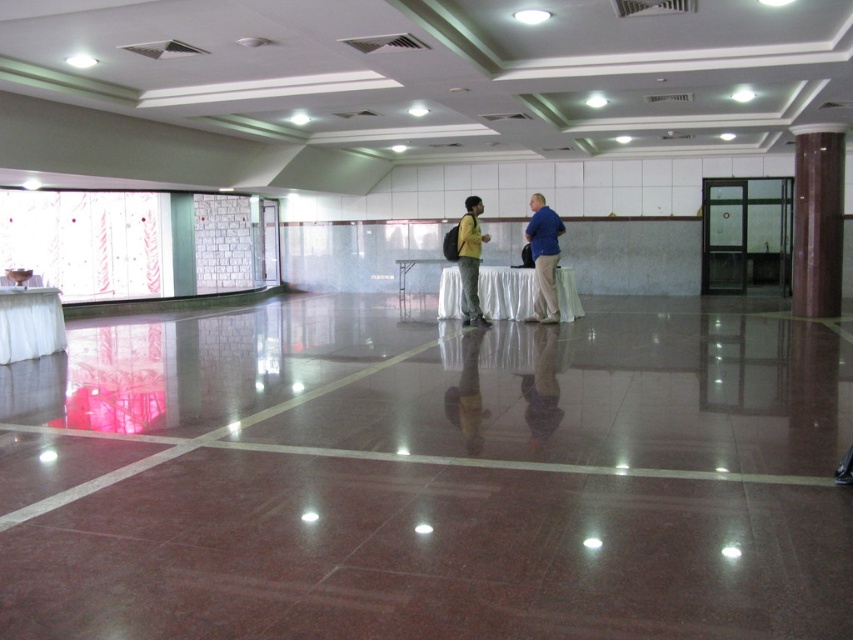
Between yellow-green fabric backpack at center and white cloth-covered table at center, which one is positioned higher?

yellow-green fabric backpack at center is higher up.

Which is behind, point (480, 202) or point (442, 282)?

The point (480, 202) is more distant.

This screenshot has height=640, width=853. I want to click on yellow-green fabric backpack at center, so click(543, 257).

Between point (54, 301) and point (558, 312), which one is positioned in front?

Point (54, 301)

Which is below, white cloth table at left or blue fabric shirt at center?

white cloth table at left

Identify the location of white cloth table at left. This screenshot has height=640, width=853. (28, 323).

The width and height of the screenshot is (853, 640). In order to click on white cloth table at left in this screenshot , I will do `click(28, 323)`.

Is brown polished column at right shorter than white cloth-covered table at center?

No.

Is the position of brown polished column at right less distant than that of white cloth-covered table at center?

No, it is behind white cloth-covered table at center.

Between point (830, 273) and point (561, 314), which one is positioned behind?

The point (830, 273) is behind.

Where is `brown polished column at right`? brown polished column at right is located at coordinates (817, 220).